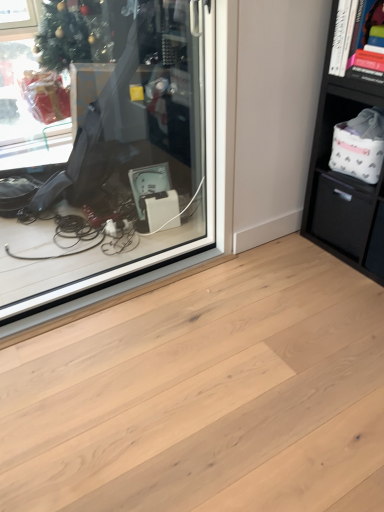
Question: Should I look upward or downward to see black matte drawer at right?

Choices:
 (A) up
 (B) down

Answer: (A)

Question: From a real-world perspective, is natural wood plank at center on black matte bookshelf at upper right?

Choices:
 (A) yes
 (B) no

Answer: (B)

Question: Can you confirm if natural wood plank at center is bigger than black matte bookshelf at upper right?

Choices:
 (A) no
 (B) yes

Answer: (B)

Question: Is natural wood plank at center to the right of black matte bookshelf at upper right from the viewer's perspective?

Choices:
 (A) no
 (B) yes

Answer: (A)

Question: From a real-world perspective, is natural wood plank at center beneath black matte bookshelf at upper right?

Choices:
 (A) no
 (B) yes

Answer: (B)

Question: Can you confirm if natural wood plank at center is taller than black matte bookshelf at upper right?

Choices:
 (A) no
 (B) yes

Answer: (A)

Question: From the image's perspective, is natural wood plank at center on top of black matte bookshelf at upper right?

Choices:
 (A) no
 (B) yes

Answer: (A)

Question: Is transparent glass shop window at center taller than black matte bookshelf at upper right?

Choices:
 (A) yes
 (B) no

Answer: (A)

Question: Is transparent glass shop window at center wider than black matte bookshelf at upper right?

Choices:
 (A) no
 (B) yes

Answer: (A)

Question: Is transparent glass shop window at center not close to black matte bookshelf at upper right?

Choices:
 (A) yes
 (B) no

Answer: (A)

Question: Is black matte bookshelf at upper right inside transparent glass shop window at center?

Choices:
 (A) yes
 (B) no

Answer: (B)

Question: From a real-world perspective, is transparent glass shop window at center on black matte bookshelf at upper right?

Choices:
 (A) no
 (B) yes

Answer: (A)

Question: Can you confirm if transparent glass shop window at center is shorter than black matte bookshelf at upper right?

Choices:
 (A) no
 (B) yes

Answer: (A)

Question: Is the depth of transparent glass shop window at center greater than that of natural wood plank at center?

Choices:
 (A) no
 (B) yes

Answer: (B)